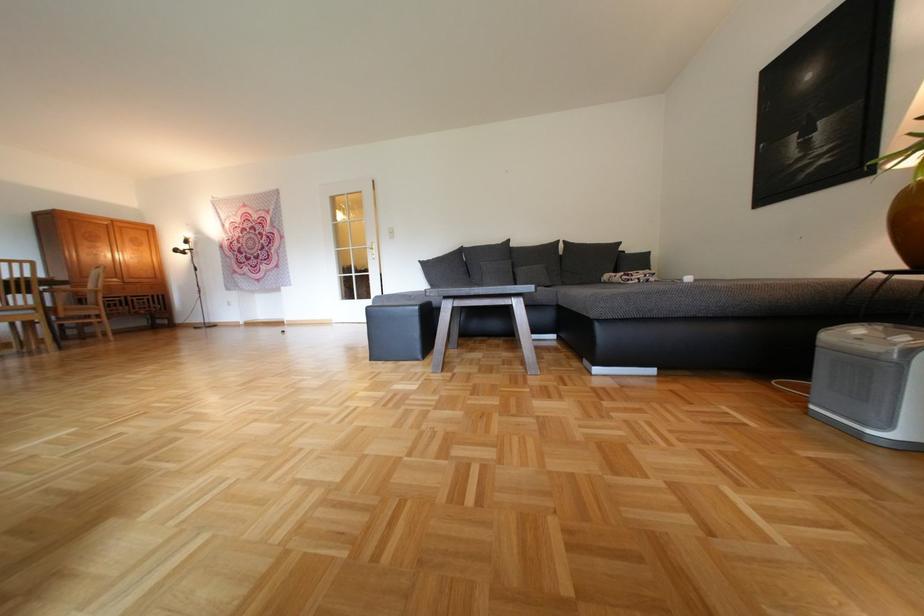
At what (x,y) coordinates should I click in order to perform the action: click on gray sofa sitting surface. Please return your answer as a coordinate pair (x, y). The height and width of the screenshot is (616, 924). Looking at the image, I should click on point(731,297).